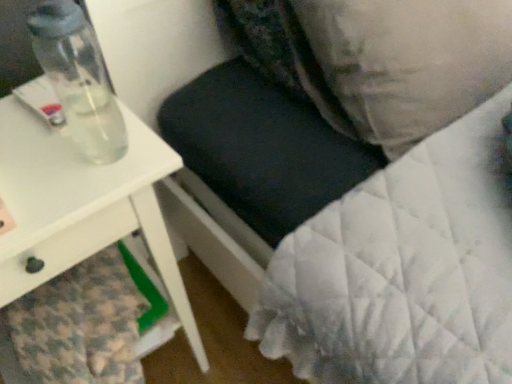
Where is `velvety black pillow at upper center, the first pillow from the left`? The height and width of the screenshot is (384, 512). velvety black pillow at upper center, the first pillow from the left is located at coordinates (284, 55).

Measure the distance between clear glass bottle at left and camera.

clear glass bottle at left is 47.87 centimeters from camera.

Find the location of `white glossy table at left`. white glossy table at left is located at coordinates (82, 205).

From the image's perspective, starting from the white glossy table at left, which pillow is the 2nd one above? Please provide its 2D coordinates.

[(284, 55)]

Can you tell me how much velvety black pillow at upper center, positioned as the 2th pillow in right-to-left order, and white glossy table at left differ in facing direction?

3.12 degrees.

Is velvety black pillow at upper center, positioned as the 2th pillow in right-to-left order, aimed at white glossy table at left?

→ No, velvety black pillow at upper center, positioned as the 2th pillow in right-to-left order, is not aimed at white glossy table at left.

Is velvety black pillow at upper center, the first pillow from the left, at the right side of white glossy table at left?

Yes, velvety black pillow at upper center, the first pillow from the left, is to the right of white glossy table at left.

From a real-world perspective, who is located lower, white quilted pillow at upper right, arranged as the first pillow when viewed from the right, or white glossy table at left?

From a 3D spatial view, white glossy table at left is below.

Is point (434, 15) closer or farther from the camera than point (19, 256)?

Point (434, 15) appears to be farther away from the viewer than point (19, 256).

This screenshot has height=384, width=512. In order to click on pillow that is the 1st one when counting upward from the white glossy table at left (from the image's perspective) in this screenshot , I will do `click(409, 60)`.

Is white quilted pillow at upper right, the 2th pillow when ordered from left to right, aimed at white glossy table at left?

No, white quilted pillow at upper right, the 2th pillow when ordered from left to right, is not facing towards white glossy table at left.

Which is more to the right, white glossy table at left or white quilted pillow at upper right, arranged as the first pillow when viewed from the right?

Positioned to the right is white quilted pillow at upper right, arranged as the first pillow when viewed from the right.

Considering the sizes of objects white glossy table at left and white quilted pillow at upper right, the 2th pillow when ordered from left to right, in the image provided, who is thinner, white glossy table at left or white quilted pillow at upper right, the 2th pillow when ordered from left to right,?

white quilted pillow at upper right, the 2th pillow when ordered from left to right, is thinner.

Looking at this image, is white glossy table at left positioned with its back to white quilted pillow at upper right, the 2th pillow when ordered from left to right?

white glossy table at left is not turned away from white quilted pillow at upper right, the 2th pillow when ordered from left to right.

Does white glossy table at left have a greater height compared to white quilted pillow at upper right, the 2th pillow when ordered from left to right?

Yes, white glossy table at left is taller than white quilted pillow at upper right, the 2th pillow when ordered from left to right.

Is clear glass bottle at left facing towards velvety black pillow at upper center, positioned as the 2th pillow in right-to-left order?

No, clear glass bottle at left does not turn towards velvety black pillow at upper center, positioned as the 2th pillow in right-to-left order.

Is clear glass bottle at left inside or outside of velvety black pillow at upper center, the first pillow from the left?

clear glass bottle at left is not enclosed by velvety black pillow at upper center, the first pillow from the left.

Based on the photo, from the image's perspective, is clear glass bottle at left positioned above or below velvety black pillow at upper center, positioned as the 2th pillow in right-to-left order?

clear glass bottle at left is below velvety black pillow at upper center, positioned as the 2th pillow in right-to-left order.

In terms of size, does clear glass bottle at left appear bigger or smaller than velvety black pillow at upper center, positioned as the 2th pillow in right-to-left order?

Considering their sizes, clear glass bottle at left takes up less space than velvety black pillow at upper center, positioned as the 2th pillow in right-to-left order.

In terms of height, does velvety black pillow at upper center, the first pillow from the left, look taller or shorter compared to white quilted pillow at upper right, the 2th pillow when ordered from left to right?

In the image, velvety black pillow at upper center, the first pillow from the left, appears to be shorter than white quilted pillow at upper right, the 2th pillow when ordered from left to right.

Does velvety black pillow at upper center, positioned as the 2th pillow in right-to-left order, appear on the left side of white quilted pillow at upper right, the 2th pillow when ordered from left to right?

Yes, velvety black pillow at upper center, positioned as the 2th pillow in right-to-left order, is to the left of white quilted pillow at upper right, the 2th pillow when ordered from left to right.

From the image's perspective, is velvety black pillow at upper center, the first pillow from the left, above or below white quilted pillow at upper right, the 2th pillow when ordered from left to right?

Based on their image positions, velvety black pillow at upper center, the first pillow from the left, is located above white quilted pillow at upper right, the 2th pillow when ordered from left to right.

From a real-world perspective, is velvety black pillow at upper center, the first pillow from the left, located beneath white quilted pillow at upper right, arranged as the first pillow when viewed from the right?

Yes, from a real-world perspective, velvety black pillow at upper center, the first pillow from the left, is under white quilted pillow at upper right, arranged as the first pillow when viewed from the right.

Is white quilted pillow at upper right, the 2th pillow when ordered from left to right, wider or thinner than velvety black pillow at upper center, the first pillow from the left?

white quilted pillow at upper right, the 2th pillow when ordered from left to right, is wider than velvety black pillow at upper center, the first pillow from the left.

Is white quilted pillow at upper right, the 2th pillow when ordered from left to right, positioned in front of velvety black pillow at upper center, positioned as the 2th pillow in right-to-left order?

Yes, the depth of white quilted pillow at upper right, the 2th pillow when ordered from left to right, is less than that of velvety black pillow at upper center, positioned as the 2th pillow in right-to-left order.

Considering the sizes of objects white quilted pillow at upper right, arranged as the first pillow when viewed from the right, and velvety black pillow at upper center, positioned as the 2th pillow in right-to-left order, in the image provided, who is bigger, white quilted pillow at upper right, arranged as the first pillow when viewed from the right, or velvety black pillow at upper center, positioned as the 2th pillow in right-to-left order,?

white quilted pillow at upper right, arranged as the first pillow when viewed from the right.

In terms of height, does white quilted pillow at upper right, arranged as the first pillow when viewed from the right, look taller or shorter compared to velvety black pillow at upper center, the first pillow from the left?

In the image, white quilted pillow at upper right, arranged as the first pillow when viewed from the right, appears to be taller than velvety black pillow at upper center, the first pillow from the left.

From a real-world perspective, is clear glass bottle at left physically above white quilted pillow at upper right, the 2th pillow when ordered from left to right?

Yes, from a real-world perspective, clear glass bottle at left is over white quilted pillow at upper right, the 2th pillow when ordered from left to right

Considering the positions of objects clear glass bottle at left and white quilted pillow at upper right, the 2th pillow when ordered from left to right, in the image provided, who is more to the right, clear glass bottle at left or white quilted pillow at upper right, the 2th pillow when ordered from left to right,?

white quilted pillow at upper right, the 2th pillow when ordered from left to right.

Is point (82, 140) positioned in front of point (330, 13)?

Yes.

Where is `table located below the velvety black pillow at upper center, the first pillow from the left (from the image's perspective)`? Image resolution: width=512 pixels, height=384 pixels. table located below the velvety black pillow at upper center, the first pillow from the left (from the image's perspective) is located at coordinates (82, 205).

Where is `table in front of the white quilted pillow at upper right, arranged as the first pillow when viewed from the right`? table in front of the white quilted pillow at upper right, arranged as the first pillow when viewed from the right is located at coordinates (82, 205).

Based on their spatial positions, is white quilted pillow at upper right, the 2th pillow when ordered from left to right, or clear glass bottle at left closer to velvety black pillow at upper center, the first pillow from the left?

white quilted pillow at upper right, the 2th pillow when ordered from left to right.

Looking at the image, which one is located further to clear glass bottle at left, white quilted pillow at upper right, arranged as the first pillow when viewed from the right, or velvety black pillow at upper center, the first pillow from the left?

white quilted pillow at upper right, arranged as the first pillow when viewed from the right, is further to clear glass bottle at left.

Based on their spatial positions, is clear glass bottle at left or velvety black pillow at upper center, the first pillow from the left, further from white quilted pillow at upper right, the 2th pillow when ordered from left to right?

The object further to white quilted pillow at upper right, the 2th pillow when ordered from left to right, is clear glass bottle at left.

From the image, which object appears to be farther from velvety black pillow at upper center, positioned as the 2th pillow in right-to-left order, white glossy table at left or clear glass bottle at left?

Based on the image, white glossy table at left appears to be further to velvety black pillow at upper center, positioned as the 2th pillow in right-to-left order.

Considering their positions, is clear glass bottle at left positioned closer to white quilted pillow at upper right, arranged as the first pillow when viewed from the right, than white glossy table at left?

white glossy table at left.

Which object lies further to the anchor point velvety black pillow at upper center, the first pillow from the left, clear glass bottle at left or white quilted pillow at upper right, arranged as the first pillow when viewed from the right?

clear glass bottle at left lies further to velvety black pillow at upper center, the first pillow from the left, than the other object.

Based on their spatial positions, is velvety black pillow at upper center, positioned as the 2th pillow in right-to-left order, or white quilted pillow at upper right, arranged as the first pillow when viewed from the right, further from clear glass bottle at left?

Based on the image, white quilted pillow at upper right, arranged as the first pillow when viewed from the right, appears to be further to clear glass bottle at left.

Looking at the image, which one is located further to clear glass bottle at left, white glossy table at left or white quilted pillow at upper right, arranged as the first pillow when viewed from the right?

white quilted pillow at upper right, arranged as the first pillow when viewed from the right, is positioned further to the anchor clear glass bottle at left.

The image size is (512, 384). Find the location of `bottle located between white glossy table at left and white quilted pillow at upper right, the 2th pillow when ordered from left to right, in the left-right direction`. bottle located between white glossy table at left and white quilted pillow at upper right, the 2th pillow when ordered from left to right, in the left-right direction is located at coordinates (78, 79).

Locate an element on the screen. pillow between white glossy table at left and white quilted pillow at upper right, the 2th pillow when ordered from left to right, from left to right is located at coordinates (284, 55).

Image resolution: width=512 pixels, height=384 pixels. I want to click on bottle that lies between velvety black pillow at upper center, positioned as the 2th pillow in right-to-left order, and white glossy table at left from top to bottom, so click(78, 79).

The height and width of the screenshot is (384, 512). I want to click on pillow located between clear glass bottle at left and white quilted pillow at upper right, the 2th pillow when ordered from left to right, in the left-right direction, so click(284, 55).